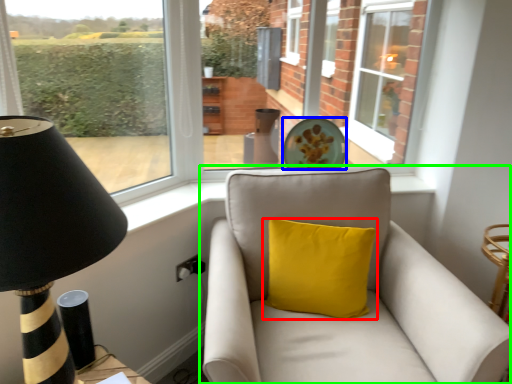
Question: Which object is the closest to the pillow (highlighted by a red box)? Choose among these: plate (highlighted by a blue box) or studio couch (highlighted by a green box).

Choices:
 (A) plate
 (B) studio couch

Answer: (B)